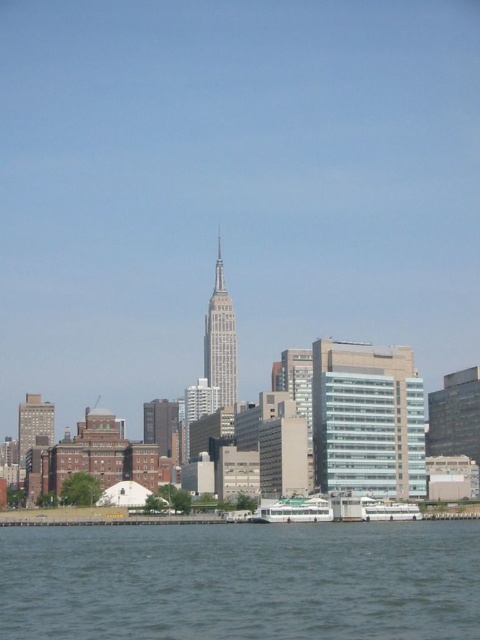
You are a tourist standing in the city and want to take a photo of the brick textured building at left and the gray glass tower at center. Since you have a wide angle lens, can you capture both in the same frame without moving your position?

The brick textured building at left is behind the gray glass tower at center, so you can capture both in the same frame without moving your position because they are aligned along the same line of sight.

You are standing on the dock and see the brick textured building at left and the white glossy boat at lower right. Which object is located to the left of the other?

The brick textured building at left is positioned on the left side of the white glossy boat at lower right, so the brick textured building at left is to the left of the white glossy boat at lower right.

You are standing at the point with coordinates (34,424) in the city skyline image. What type of building are you currently located in?

The point at (34,424) corresponds to a brick textured building at left, so you are located in the brick textured building at left.